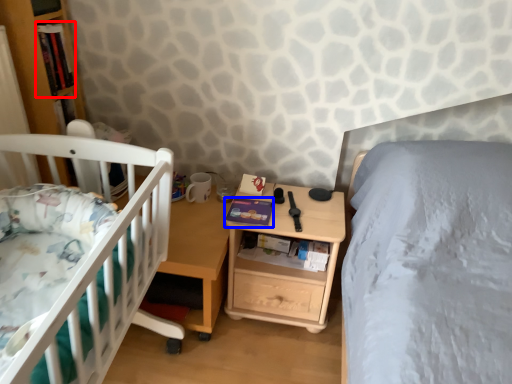
Question: Among these objects, which one is farthest to the camera, book (highlighted by a red box) or book (highlighted by a blue box)?

Choices:
 (A) book
 (B) book

Answer: (B)